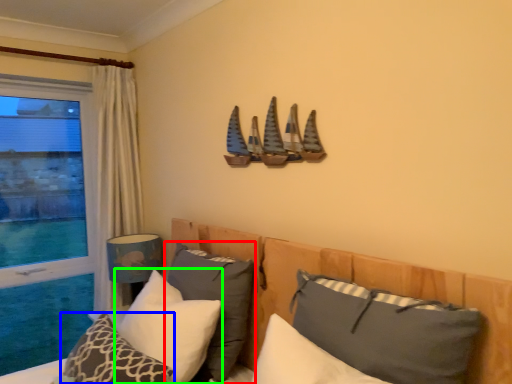
Question: Which is farther away from pillow (highlighted by a red box)? pillow (highlighted by a blue box) or pillow (highlighted by a green box)?

Choices:
 (A) pillow
 (B) pillow

Answer: (A)